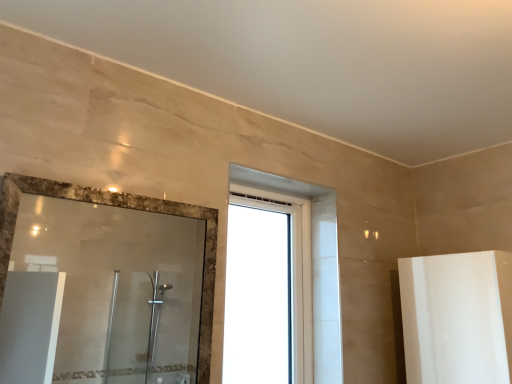
Question: From a real-world perspective, is polished glass mirror at left below transparent glass window at center?

Choices:
 (A) no
 (B) yes

Answer: (B)

Question: Can you confirm if polished glass mirror at left is thinner than transparent glass window at center?

Choices:
 (A) yes
 (B) no

Answer: (A)

Question: Can you confirm if polished glass mirror at left is shorter than transparent glass window at center?

Choices:
 (A) no
 (B) yes

Answer: (B)

Question: Is polished glass mirror at left aimed at transparent glass window at center?

Choices:
 (A) yes
 (B) no

Answer: (B)

Question: Is polished glass mirror at left positioned beyond the bounds of transparent glass window at center?

Choices:
 (A) no
 (B) yes

Answer: (B)

Question: From a real-world perspective, is polished glass mirror at left located higher than transparent glass window at center?

Choices:
 (A) yes
 (B) no

Answer: (B)

Question: From a real-world perspective, is transparent glass window at center over polished glass mirror at left?

Choices:
 (A) no
 (B) yes

Answer: (B)

Question: Is transparent glass window at center positioned in front of polished glass mirror at left?

Choices:
 (A) no
 (B) yes

Answer: (A)

Question: Is transparent glass window at center positioned beyond the bounds of polished glass mirror at left?

Choices:
 (A) yes
 (B) no

Answer: (A)

Question: Does transparent glass window at center have a larger size compared to polished glass mirror at left?

Choices:
 (A) yes
 (B) no

Answer: (A)

Question: From the image's perspective, would you say transparent glass window at center is positioned over polished glass mirror at left?

Choices:
 (A) no
 (B) yes

Answer: (A)

Question: From the image's perspective, does transparent glass window at center appear lower than polished glass mirror at left?

Choices:
 (A) no
 (B) yes

Answer: (B)

Question: From a real-world perspective, relative to transparent glass window at center, is polished glass mirror at left vertically above or below?

Choices:
 (A) above
 (B) below

Answer: (B)